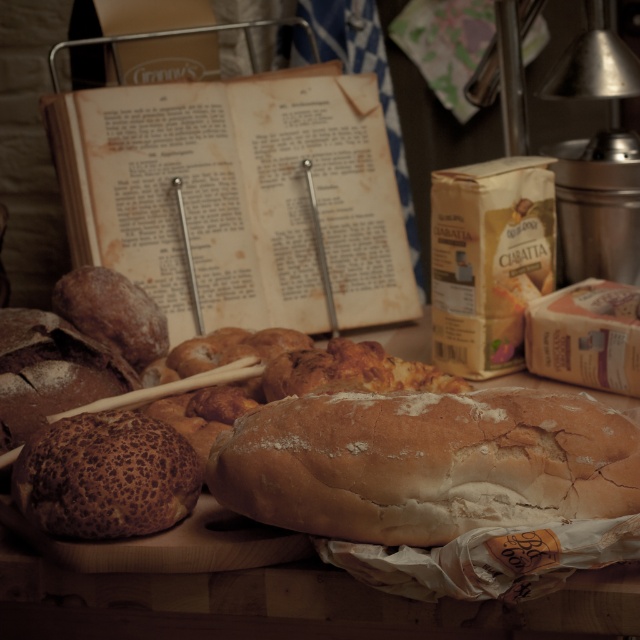
Does golden brown crusty loaf of bread at center appear on the right side of leopard-patterned crust at center?

Indeed, golden brown crusty loaf of bread at center is positioned on the right side of leopard-patterned crust at center.

Is golden brown crusty loaf of bread at center further to camera compared to leopard-patterned crust at center?

No, it is not.

Find the location of a particular element. golden brown crusty loaf of bread at center is located at coordinates (426, 461).